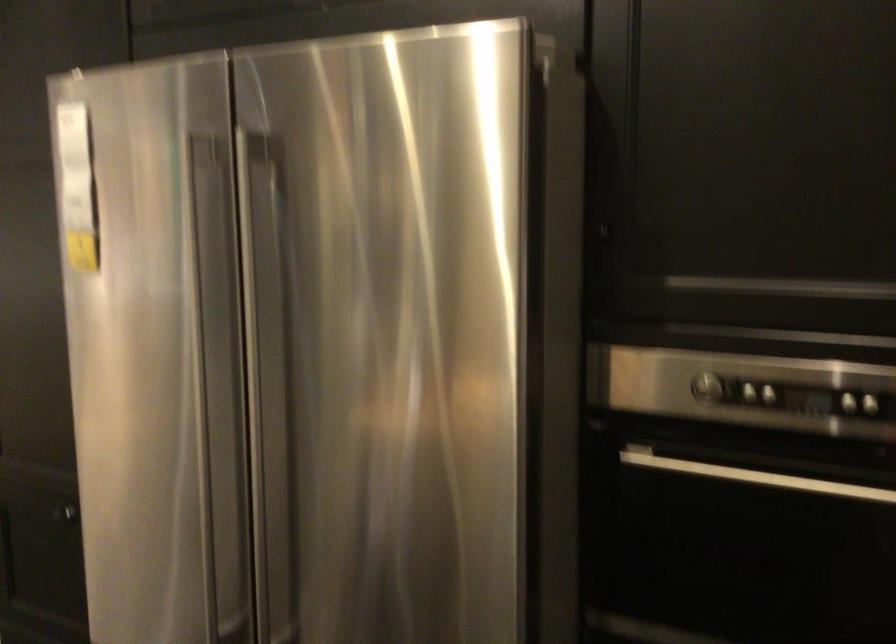
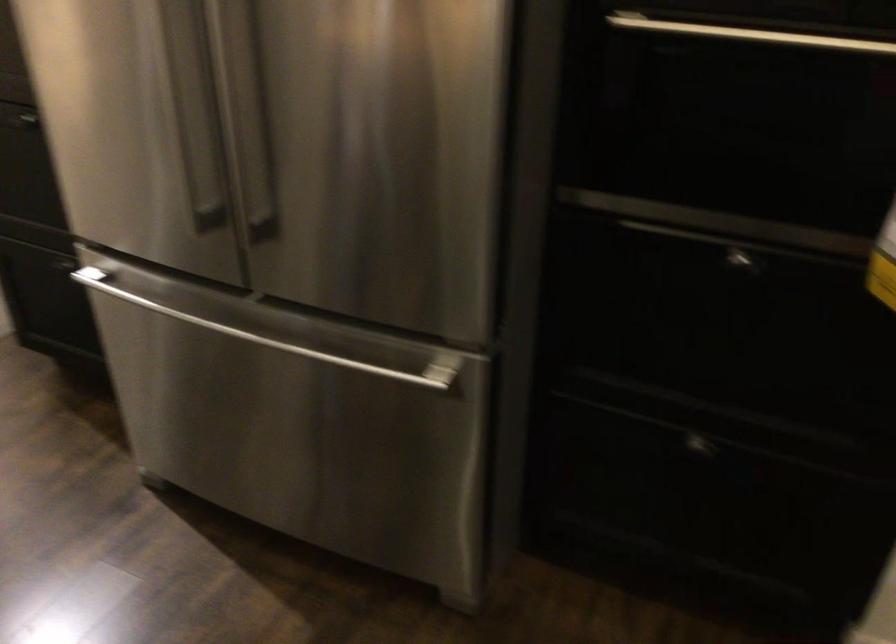
Question: Based on the continuous images, in which direction is the camera rotating? Reply with the corresponding letter.

Choices:
 (A) Left
 (B) Right
 (C) Up
 (D) Down

Answer: (D)